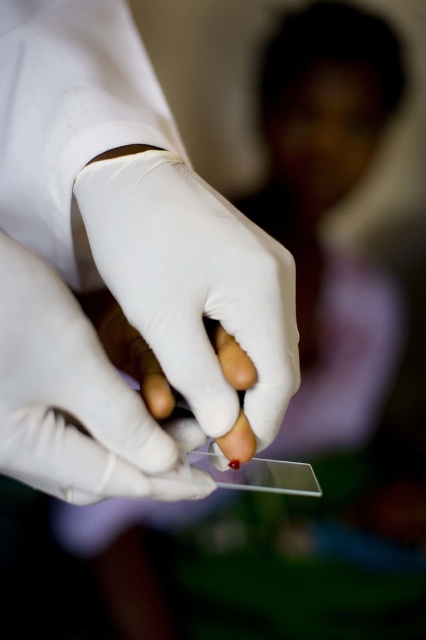
What are the coordinates of the transparent glass slide at center?

The transparent glass slide at center is located at coordinates point [118,266].

You are a medical assistant observing a procedure where a slide is being prepared with blood. You notice two pairs of gloves at the center of your view. The first pair is labeled as white smooth gloves, and the second pair is white matte gloves. To ensure proper handling, you need to know the distance between them. Can you confirm if the distance between the white smooth glove at center and the white matte gloves at center is sufficient for a 2.5 inch tool to fit between them?

The white smooth glove at center is 2.19 inches from white matte gloves at center. Since the tool is 2.5 inches wide, the distance between them is insufficient to fit the tool between the white smooth glove at center and the white matte gloves at center.